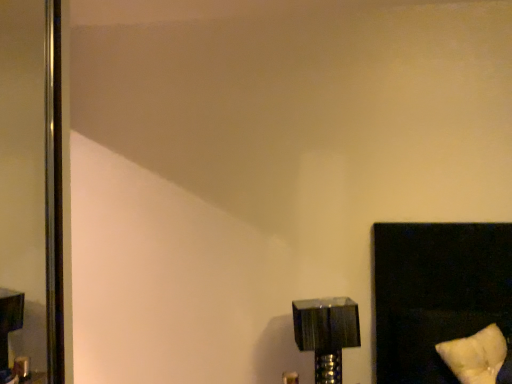
Question: From a real-world perspective, is metallic silver lamp at lower right physically located above or below polished metallic screen door at left?

Choices:
 (A) above
 (B) below

Answer: (B)

Question: Is metallic silver lamp at lower right situated inside polished metallic screen door at left or outside?

Choices:
 (A) outside
 (B) inside

Answer: (A)

Question: Which object is the closest to the metallic silver lamp at lower right?

Choices:
 (A) white soft pillow at lower right
 (B) polished metallic screen door at left

Answer: (A)

Question: Which of these objects is positioned closest to the metallic silver lamp at lower right?

Choices:
 (A) polished metallic screen door at left
 (B) white soft pillow at lower right

Answer: (B)